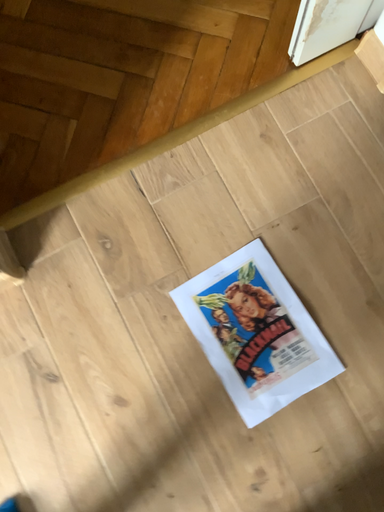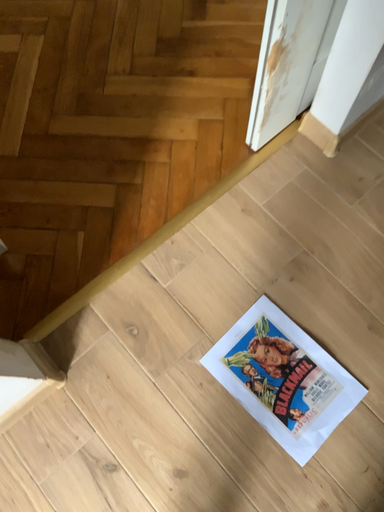
Question: How did the camera likely rotate when shooting the video?

Choices:
 (A) rotated upward
 (B) rotated downward

Answer: (A)